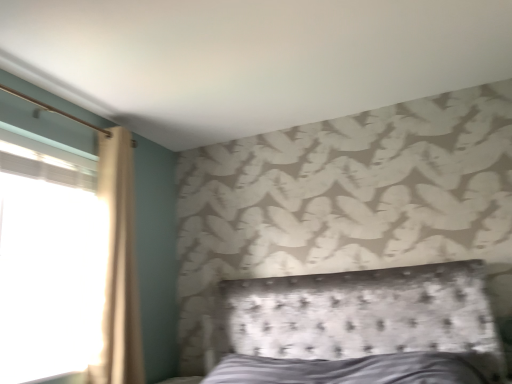
This screenshot has width=512, height=384. In order to click on transparent glass window at left in this screenshot , I will do `click(46, 264)`.

Describe the element at coordinates (46, 264) in the screenshot. The height and width of the screenshot is (384, 512). I see `transparent glass window at left` at that location.

What do you see at coordinates (117, 266) in the screenshot? I see `beige fabric curtain at left` at bounding box center [117, 266].

In order to face beige fabric curtain at left, should I rotate leftwards or rightwards?

A 17.670 degree turn to the left will do.

I want to click on beige fabric curtain at left, so click(x=117, y=266).

Measure the distance between point (105,347) and camera.

2.42 meters.

This screenshot has width=512, height=384. Find the location of `transparent glass window at left`. transparent glass window at left is located at coordinates (46, 264).

Is transparent glass window at left at the right side of beige fabric curtain at left?

Incorrect, transparent glass window at left is not on the right side of beige fabric curtain at left.

Does transparent glass window at left lie behind beige fabric curtain at left?

No, transparent glass window at left is closer to the camera.

Which is farther from the camera, (42, 337) or (104, 217)?

The point (104, 217) is behind.

From the image's perspective, between transparent glass window at left and beige fabric curtain at left, which one is located above?

beige fabric curtain at left, from the image's perspective.

Based on the photo, from a real-world perspective, does transparent glass window at left stand above beige fabric curtain at left?

No.

Between transparent glass window at left and beige fabric curtain at left, which one has larger width?

beige fabric curtain at left.

From their relative heights in the image, would you say transparent glass window at left is taller or shorter than beige fabric curtain at left?

transparent glass window at left is shorter than beige fabric curtain at left.

Which of these two, transparent glass window at left or beige fabric curtain at left, is smaller?

transparent glass window at left is smaller.

Choose the correct answer: Is transparent glass window at left inside beige fabric curtain at left or outside it?

transparent glass window at left is not enclosed by beige fabric curtain at left.

Is transparent glass window at left placed right next to beige fabric curtain at left?

No, transparent glass window at left is not beside beige fabric curtain at left.

Looking at this image, is transparent glass window at left turned away from beige fabric curtain at left?

No.

Locate an element on the screen. The height and width of the screenshot is (384, 512). window on the left of beige fabric curtain at left is located at coordinates (46, 264).

Considering the relative positions of beige fabric curtain at left and transparent glass window at left in the image provided, is beige fabric curtain at left to the left or to the right of transparent glass window at left?

From the image, it's evident that beige fabric curtain at left is to the right of transparent glass window at left.

Is the depth of beige fabric curtain at left greater than that of transparent glass window at left?

Yes.

Which is behind, point (130, 231) or point (70, 330)?

Positioned behind is point (70, 330).

From the image's perspective, is beige fabric curtain at left over transparent glass window at left?

Correct, beige fabric curtain at left appears higher than transparent glass window at left in the image.

From a real-world perspective, which is physically above, beige fabric curtain at left or transparent glass window at left?

beige fabric curtain at left is physically above.

Which object is thinner, beige fabric curtain at left or transparent glass window at left?

transparent glass window at left is thinner.

Does beige fabric curtain at left have a greater height compared to transparent glass window at left?

Indeed, beige fabric curtain at left has a greater height compared to transparent glass window at left.

Considering the sizes of objects beige fabric curtain at left and transparent glass window at left in the image provided, who is bigger, beige fabric curtain at left or transparent glass window at left?

With larger size is beige fabric curtain at left.

Would you say transparent glass window at left is part of beige fabric curtain at left's contents?

No, transparent glass window at left is not a part of beige fabric curtain at left.

Are beige fabric curtain at left and transparent glass window at left beside each other?

No, beige fabric curtain at left is not in contact with transparent glass window at left.

Is beige fabric curtain at left facing towards transparent glass window at left?

No, beige fabric curtain at left does not turn towards transparent glass window at left.

The height and width of the screenshot is (384, 512). In the image, there is a beige fabric curtain at left. What are the coordinates of `window below it (from a real-world perspective)` in the screenshot? It's located at (46, 264).

In order to click on curtain on the right of transparent glass window at left in this screenshot , I will do `click(117, 266)`.

Locate an element on the screen. window below the beige fabric curtain at left (from the image's perspective) is located at coordinates (46, 264).